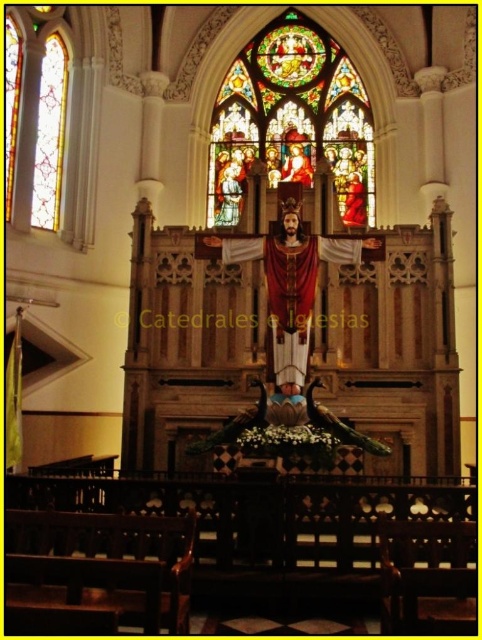
You are standing at the entrance of the church and looking towards the altar. Which stained glass, the stained glass at upper center or the stained glass window at left, appears closer to you?

The stained glass at upper center appears closer to you because the stained glass window at left is behind it.

You are standing in front of the church altar and want to place a small candle at one of the two points marked in the image. The first point is at coordinates point (310, 177) and the second is at point (38, 148). Which point is closer to you so that the candle will be more visible to the congregation?

Point (310, 177) is further to the viewer than point (38, 148), so placing the candle at point (310, 177) will make it more visible to the congregation because it is closer to you.

You are standing at the entrance of the church and want to locate the central figure of Jesus Christ on the altar. Which direction should you look relative to the point labeled as point [292,120]?

The central figure of Jesus Christ on the altar is below the point labeled as point [292,120] because the point is on the stained glass at upper center, which is above the altar area.